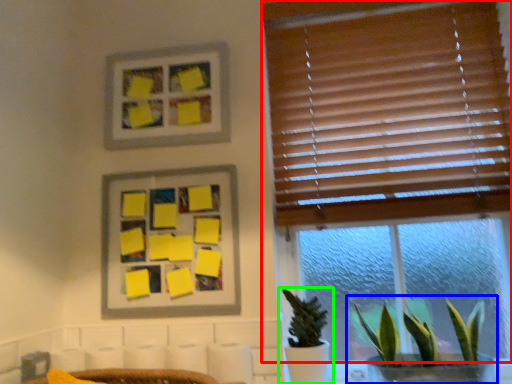
Question: Based on their relative distances, which object is farther from window (highlighted by a red box)? Choose from houseplant (highlighted by a blue box) and houseplant (highlighted by a green box).

Choices:
 (A) houseplant
 (B) houseplant

Answer: (B)